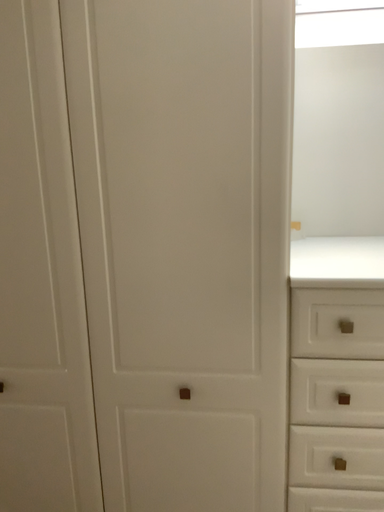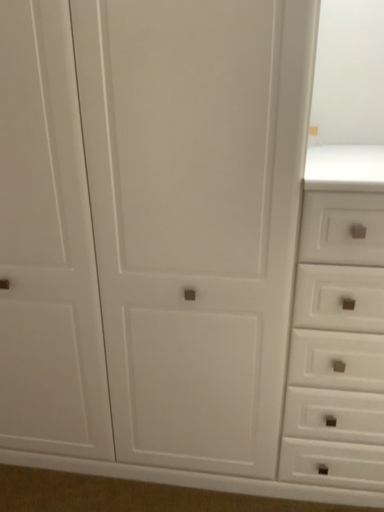
Question: How did the camera likely rotate when shooting the video?

Choices:
 (A) rotated downward
 (B) rotated upward

Answer: (A)